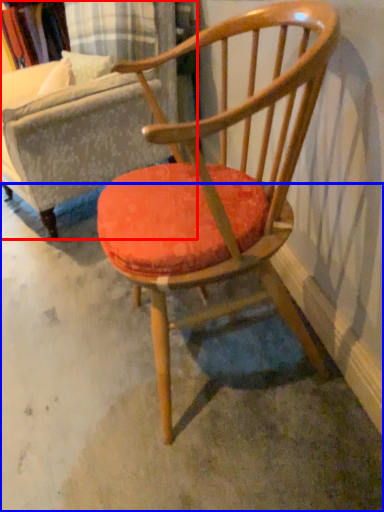
Question: Which object appears closest to the camera in this image, swivel chair (highlighted by a red box) or concrete (highlighted by a blue box)?

Choices:
 (A) swivel chair
 (B) concrete

Answer: (B)